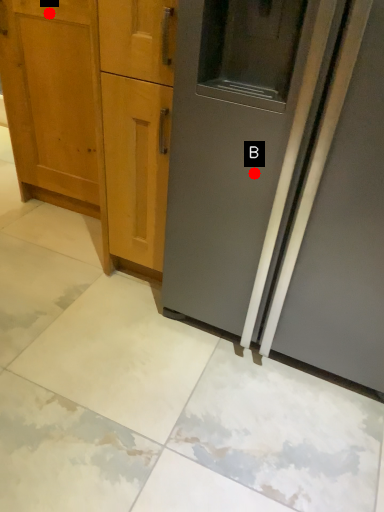
Question: Two points are circled on the image, labeled by A and B beside each circle. Which of the following is the closest to the observer?

Choices:
 (A) A is closer
 (B) B is closer

Answer: (B)